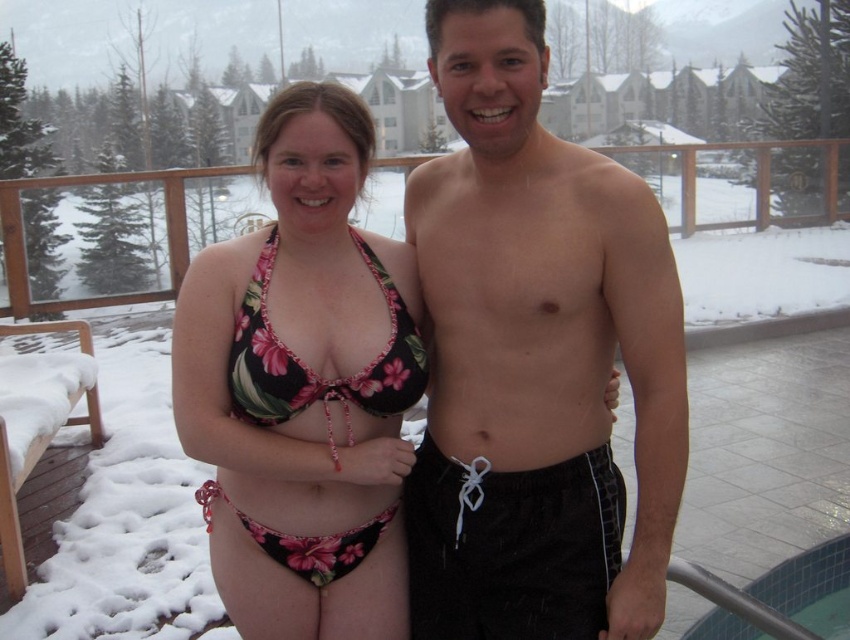
Question: Which point is closer to the camera?

Choices:
 (A) (573, 378)
 (B) (346, 202)

Answer: (A)

Question: Which of the following is the farthest from the observer?

Choices:
 (A) black fabric shorts at right
 (B) black fabric at center
 (C) floral print fabric bikini top at center

Answer: (C)

Question: Is black fabric at center to the right of floral print fabric bikini top at center from the viewer's perspective?

Choices:
 (A) yes
 (B) no

Answer: (A)

Question: Considering the relative positions of floral print bikini top at center and black fabric at center in the image provided, where is floral print bikini top at center located with respect to black fabric at center?

Choices:
 (A) below
 (B) above

Answer: (A)

Question: Which point is closer to the camera?

Choices:
 (A) (848, 605)
 (B) (456, 552)

Answer: (B)

Question: Can you confirm if black fabric at center is bigger than blue tile pool at lower right?

Choices:
 (A) yes
 (B) no

Answer: (B)